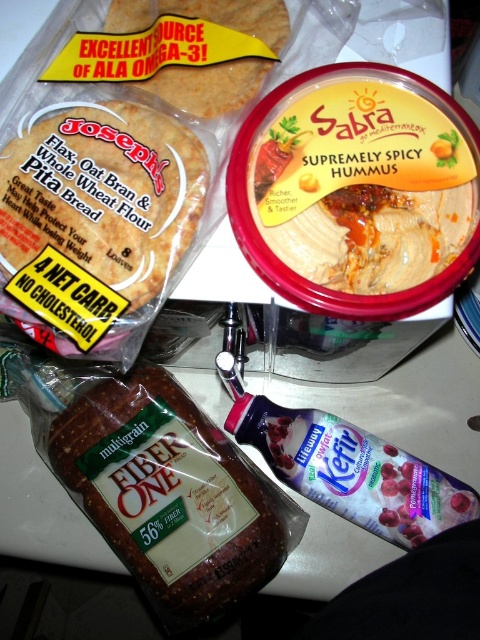
Which is more to the right, brown multigrain fiber one at center or golden brown pita bread at upper left?

brown multigrain fiber one at center is more to the right.

From the picture: Is brown multigrain fiber one at center to the left of golden brown pita bread at upper left from the viewer's perspective?

In fact, brown multigrain fiber one at center is to the right of golden brown pita bread at upper left.

Which is behind, point (276, 515) or point (47, 196)?

Point (276, 515)

I want to click on brown multigrain fiber one at center, so click(168, 496).

Is golden brown pita bread at upper left further to camera compared to matte brown pita bread at upper left?

No, golden brown pita bread at upper left is closer to the viewer.

Can you confirm if golden brown pita bread at upper left is thinner than matte brown pita bread at upper left?

In fact, golden brown pita bread at upper left might be wider than matte brown pita bread at upper left.

Locate an element on the screen. This screenshot has height=640, width=480. golden brown pita bread at upper left is located at coordinates (104, 195).

Is brown multigrain fiber one at center bigger than matte brown pita bread at upper left?

Correct, brown multigrain fiber one at center is larger in size than matte brown pita bread at upper left.

Locate an element on the screen. The height and width of the screenshot is (640, 480). brown multigrain fiber one at center is located at coordinates (168, 496).

Is point (262, 484) positioned after point (187, 1)?

Yes.

You are a GUI agent. You are given a task and a screenshot of the screen. Output one action in this format:
    pyautogui.click(x=<x>, y=<y>)
    Task: Click on the brown multigrain fiber one at center
    The height and width of the screenshot is (640, 480).
    Given the screenshot: What is the action you would take?
    (x=168, y=496)